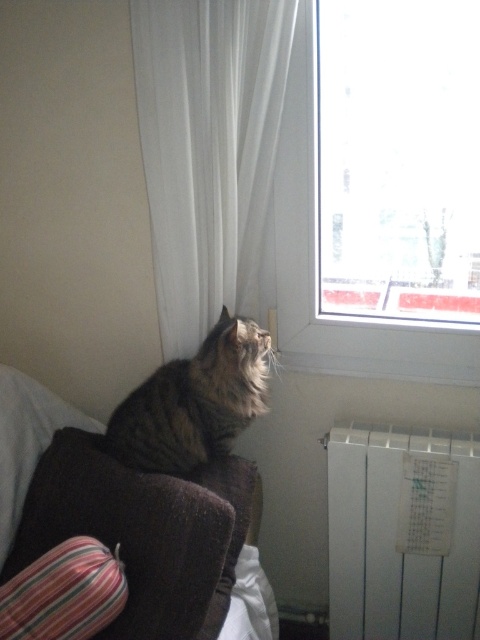
Question: Is white sheer curtain at upper center closer to the viewer compared to transparent glass window at upper right?

Choices:
 (A) yes
 (B) no

Answer: (A)

Question: Is transparent glass window at upper right to the left of velvet brown couch at lower left from the viewer's perspective?

Choices:
 (A) yes
 (B) no

Answer: (B)

Question: Which point is farther to the camera?

Choices:
 (A) (173, 412)
 (B) (408, 438)
 (C) (16, 413)

Answer: (B)

Question: Which object is the closest to the white matte radiator at lower right?

Choices:
 (A) velvet brown couch at lower left
 (B) white sheer curtain at upper center
 (C) tabby fur cat at upper left
 (D) transparent glass window at upper right

Answer: (D)

Question: Does white matte radiator at lower right appear over tabby fur cat at upper left?

Choices:
 (A) yes
 (B) no

Answer: (B)

Question: Which object is closer to the camera taking this photo?

Choices:
 (A) transparent glass window at upper right
 (B) velvet brown couch at lower left
 (C) white sheer curtain at upper center

Answer: (C)